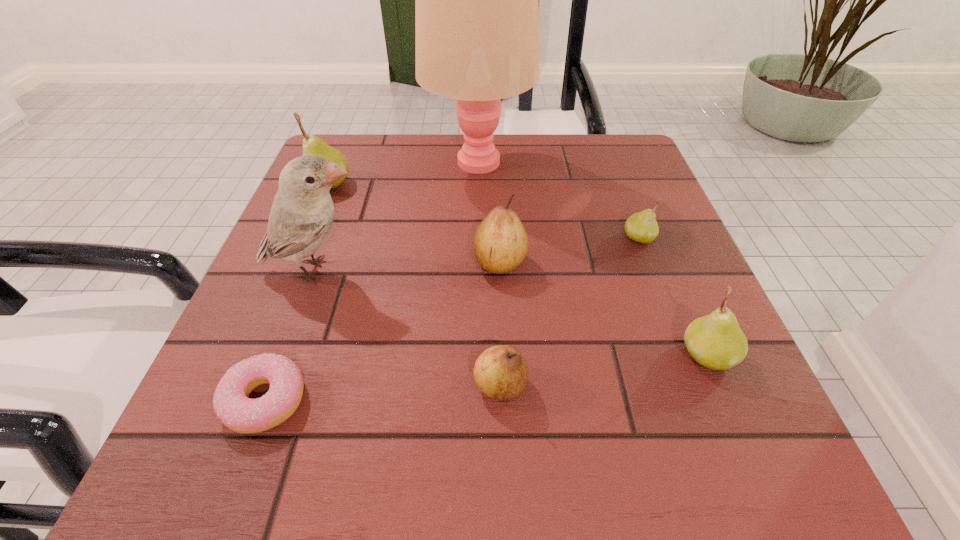
In the image, there is a desktop. Where is `vacant space at the left edge`? vacant space at the left edge is located at coordinates (343, 293).

This screenshot has height=540, width=960. Find the location of `vacant space at the right edge of the desktop`. vacant space at the right edge of the desktop is located at coordinates (670, 258).

Where is `free space at the far left corner`? The height and width of the screenshot is (540, 960). free space at the far left corner is located at coordinates (365, 142).

I want to click on vacant space at the near left corner, so click(x=215, y=467).

Image resolution: width=960 pixels, height=540 pixels. In the image, there is a desktop. Find the location of `free space at the far right corner`. free space at the far right corner is located at coordinates (633, 164).

This screenshot has width=960, height=540. I want to click on free spot between the pink lampshade and the farther brown pear, so click(489, 213).

Locate an element on the screen. free space between the second farthest green pear and the farther brown pear is located at coordinates (569, 250).

At what (x,y) coordinates should I click in order to perform the action: click on free space between the smallest green pear and the smaller brown pear. Please return your answer as a coordinate pair (x, y). This screenshot has width=960, height=540. Looking at the image, I should click on (569, 311).

Locate an element on the screen. empty space that is in between the lampshade and the pink doughnut is located at coordinates (372, 282).

Where is `vacant area that lies between the smaller brown pear and the pink lampshade`? This screenshot has width=960, height=540. vacant area that lies between the smaller brown pear and the pink lampshade is located at coordinates (489, 274).